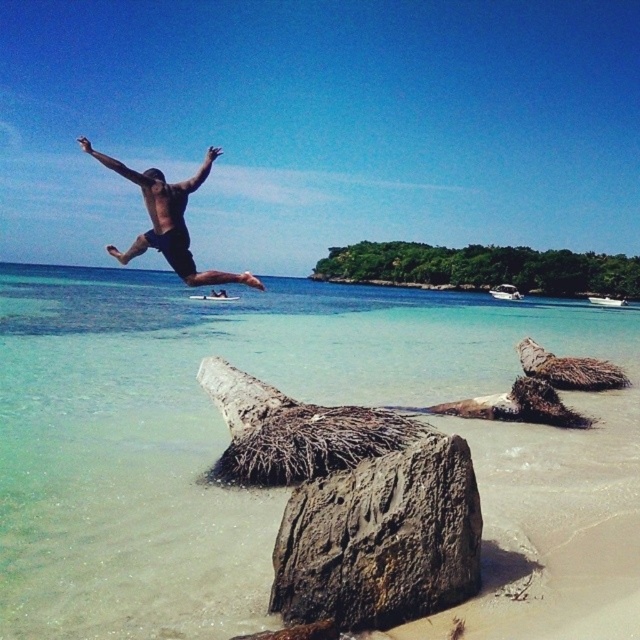
Question: Where is rusty metallic rock at lower center located in relation to matte black shorts at upper center in the image?

Choices:
 (A) left
 (B) right

Answer: (B)

Question: Which point is closer to the camera taking this photo?

Choices:
 (A) (280, 602)
 (B) (496, 472)

Answer: (A)

Question: Which point is farther from the camera taking this photo?

Choices:
 (A) (195, 269)
 (B) (19, 586)
 (C) (330, 614)

Answer: (A)

Question: Which object is farther from the camera taking this photo?

Choices:
 (A) matte black shorts at upper center
 (B) rusty metallic rock at lower center
 (C) clear sand at lower center

Answer: (A)

Question: Is clear sand at lower center closer to the viewer compared to rusty metallic rock at lower center?

Choices:
 (A) yes
 (B) no

Answer: (A)

Question: Can you confirm if clear sand at lower center is smaller than rusty metallic rock at lower center?

Choices:
 (A) yes
 (B) no

Answer: (B)